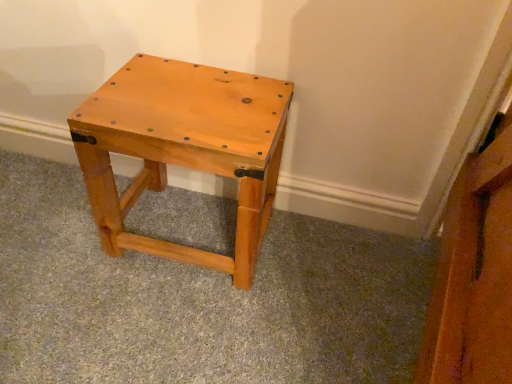
This screenshot has width=512, height=384. Identify the location of vacant space positioned to the left of natural wood stool at center. coord(55,231).